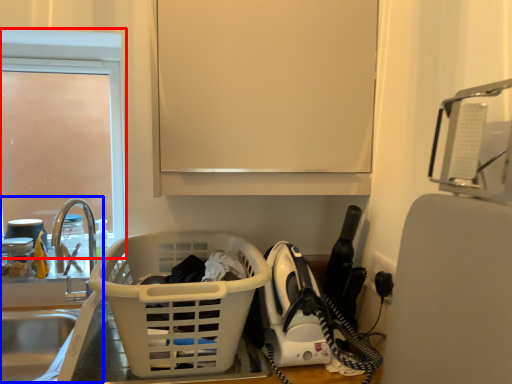
Question: Which of the following is the closest to the observer, glass door (highlighted by a red box) or sink (highlighted by a blue box)?

Choices:
 (A) glass door
 (B) sink

Answer: (B)